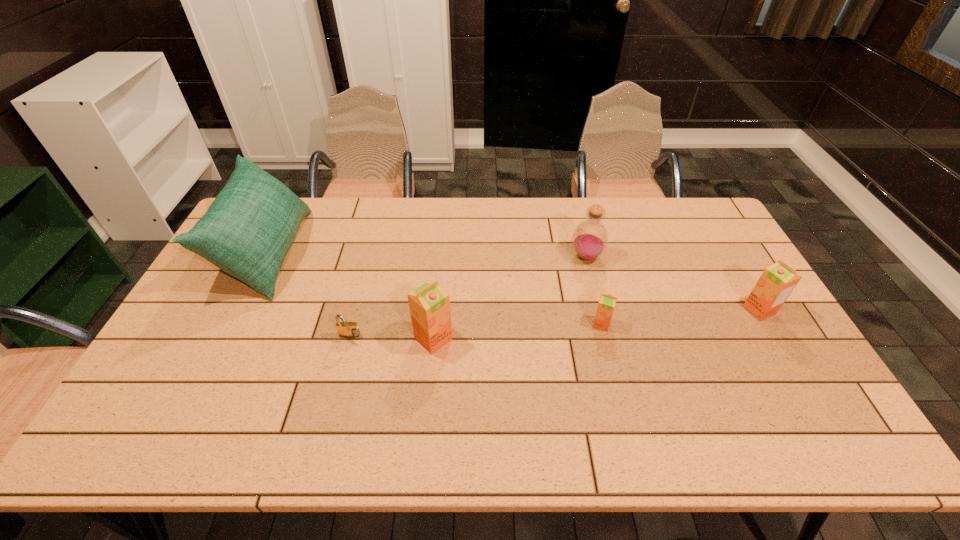
This screenshot has width=960, height=540. In order to click on vacant space located on the left of the leftmost orange juice in this screenshot , I will do `click(295, 339)`.

In order to click on free space located on the left of the second orange juice from right to left in this screenshot , I will do click(557, 324).

Find the location of a particular element. This screenshot has height=540, width=960. vacant area situated 0.120m on the front of the second tallest orange juice is located at coordinates (786, 356).

Locate an element on the screen. The width and height of the screenshot is (960, 540). free point located on the right of the bottle is located at coordinates (636, 256).

Find the location of a particular element. Image resolution: width=960 pixels, height=540 pixels. free point located 0.130m on the front-facing side of the tallest object is located at coordinates (343, 253).

Image resolution: width=960 pixels, height=540 pixels. What are the coordinates of `vacant space located 0.170m on the side with the combination dials of the second object from left to right` in the screenshot? It's located at (334, 400).

The width and height of the screenshot is (960, 540). In order to click on object present at the far edge in this screenshot , I will do `click(247, 231)`.

Where is `object that is at the left edge`? The height and width of the screenshot is (540, 960). object that is at the left edge is located at coordinates (247, 231).

Identify the location of object at the right edge. This screenshot has width=960, height=540. (776, 283).

Locate an element on the screen. The image size is (960, 540). object at the far left corner is located at coordinates (247, 231).